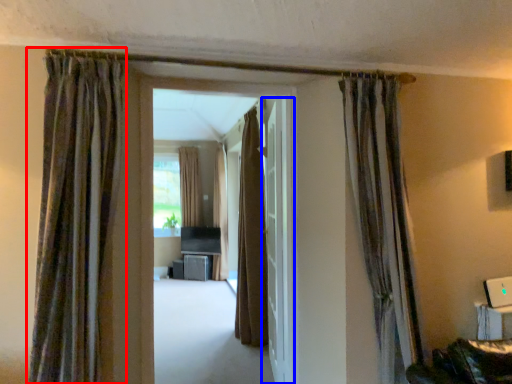
Question: Among these objects, which one is farthest to the camera, curtain (highlighted by a red box) or door (highlighted by a blue box)?

Choices:
 (A) curtain
 (B) door

Answer: (B)